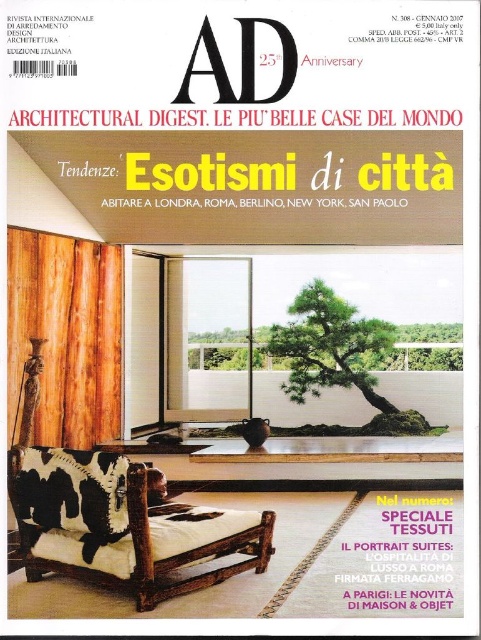
Question: Among these points, which one is nearest to the camera?

Choices:
 (A) (229, 337)
 (B) (321, 301)

Answer: (B)

Question: Does green textured bonsai at center have a larger size compared to green leafy tree at center?

Choices:
 (A) no
 (B) yes

Answer: (B)

Question: Is green textured bonsai at center closer to the viewer compared to green leafy tree at center?

Choices:
 (A) yes
 (B) no

Answer: (A)

Question: Which point is farther from the camera taking this photo?

Choices:
 (A) (214, 356)
 (B) (381, 410)

Answer: (A)

Question: Is green textured bonsai at center behind green leafy tree at center?

Choices:
 (A) no
 (B) yes

Answer: (A)